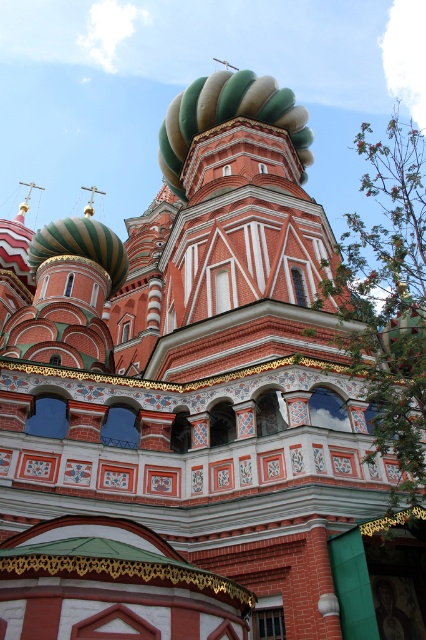
Between green glossy onion dome at center and green striped dome at upper left, which one has less height?

Standing shorter between the two is green striped dome at upper left.

Who is higher up, green glossy onion dome at center or green striped dome at upper left?

Positioned higher is green glossy onion dome at center.

Image resolution: width=426 pixels, height=640 pixels. Find the location of `green glossy onion dome at center`. green glossy onion dome at center is located at coordinates (229, 116).

The height and width of the screenshot is (640, 426). I want to click on green glossy onion dome at center, so click(229, 116).